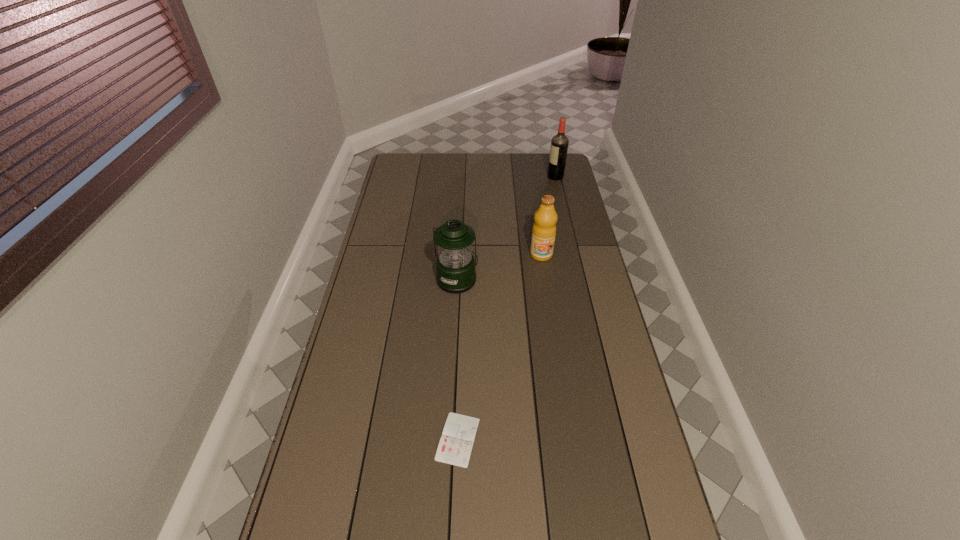
Find the location of `the rightmost object`. the rightmost object is located at coordinates (559, 144).

At what (x,y) coordinates should I click in order to perform the action: click on liquor. Please return your answer as a coordinate pair (x, y). This screenshot has height=540, width=960. Looking at the image, I should click on (559, 144).

The image size is (960, 540). I want to click on the second object from right to left, so click(x=544, y=228).

I want to click on the third nearest object, so click(544, 228).

Where is `the third farthest object`? This screenshot has width=960, height=540. the third farthest object is located at coordinates (455, 264).

This screenshot has height=540, width=960. In order to click on the shortest object in this screenshot , I will do `click(455, 446)`.

Locate an element on the screen. diary is located at coordinates (455, 446).

I want to click on vacant position located 0.220m on the front-facing side of the farthest object, so click(503, 177).

The height and width of the screenshot is (540, 960). In order to click on blank space located on the front-facing side of the farthest object in this screenshot , I will do `click(517, 177)`.

Where is `free space located on the front-facing side of the farthest object`? The width and height of the screenshot is (960, 540). free space located on the front-facing side of the farthest object is located at coordinates (501, 177).